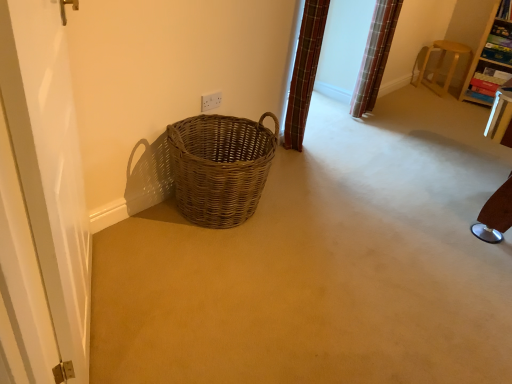
The width and height of the screenshot is (512, 384). What are the coordinates of `free space in front of plaid fabric curtain at upper right, which is the second curtain from left to right` in the screenshot? It's located at (371, 119).